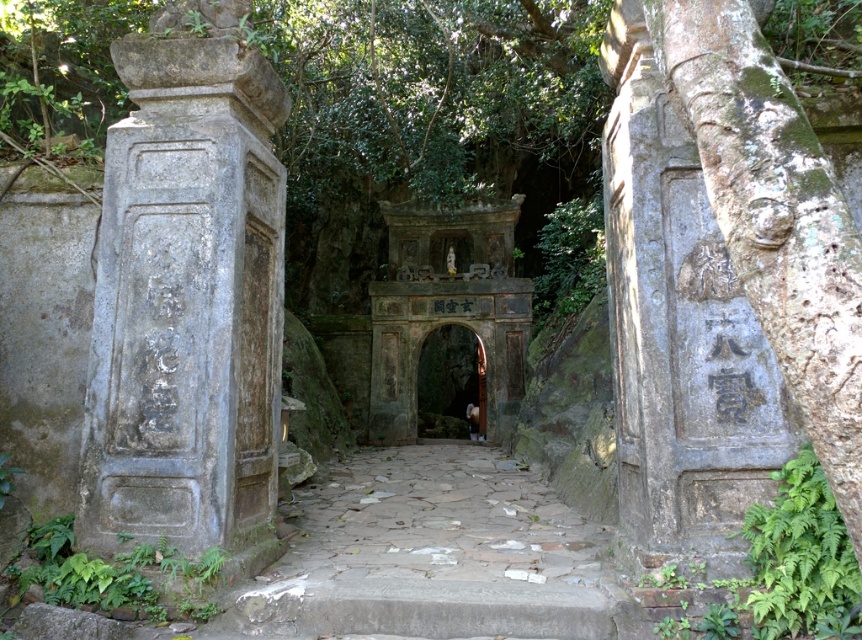
Is point (251, 464) positioned behind point (829, 560)?

That is True.

What do you see at coordinates (188, 298) in the screenshot?
I see `gray stone pillar at left` at bounding box center [188, 298].

Image resolution: width=862 pixels, height=640 pixels. I want to click on gray stone pillar at left, so click(x=188, y=298).

Does point (454, 568) come farther from viewer compared to point (786, 566)?

Yes, it is behind point (786, 566).

Does point (257, 628) lie behind point (753, 577)?

Yes, it is behind point (753, 577).

At what (x,y) coordinates should I click in order to perform the action: click on stone paved path at center. Please return your answer as a coordinate pair (x, y). The height and width of the screenshot is (640, 862). Looking at the image, I should click on (431, 556).

Between stone paved path at center and green leafy plant at lower left, which one appears on the left side from the viewer's perspective?

green leafy plant at lower left

At what (x,y) coordinates should I click in order to perform the action: click on stone paved path at center. Please return your answer as a coordinate pair (x, y). The image size is (862, 640). Looking at the image, I should click on (431, 556).

Is point (416, 612) positioned after point (48, 589)?

No, it is not.

Identify the location of stone paved path at center. (431, 556).